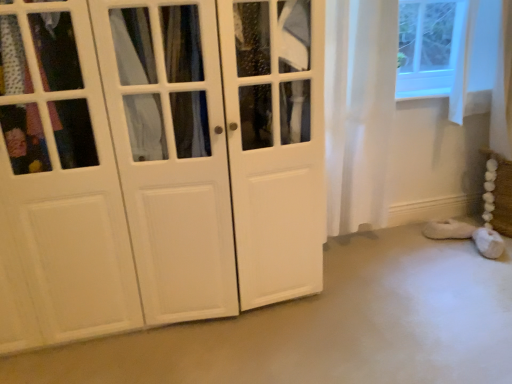
Question: Should I look upward or downward to see white fluffy slipper at lower right?

Choices:
 (A) down
 (B) up

Answer: (A)

Question: Can white sheer curtain at right be found inside white matte cabinet at left?

Choices:
 (A) yes
 (B) no

Answer: (B)

Question: Is white matte cabinet at left closer to the viewer compared to white sheer curtain at right?

Choices:
 (A) yes
 (B) no

Answer: (A)

Question: Considering the relative positions of white matte cabinet at left and white sheer curtain at right in the image provided, is white matte cabinet at left behind white sheer curtain at right?

Choices:
 (A) no
 (B) yes

Answer: (A)

Question: Is white matte cabinet at left positioned with its back to white sheer curtain at right?

Choices:
 (A) no
 (B) yes

Answer: (A)

Question: Considering the relative sizes of white matte cabinet at left and white sheer curtain at right in the image provided, is white matte cabinet at left taller than white sheer curtain at right?

Choices:
 (A) yes
 (B) no

Answer: (A)

Question: Considering the relative sizes of white matte cabinet at left and white sheer curtain at right in the image provided, is white matte cabinet at left shorter than white sheer curtain at right?

Choices:
 (A) yes
 (B) no

Answer: (B)

Question: From a real-world perspective, does white fluffy slipper at lower right stand above white matte cabinet at left?

Choices:
 (A) no
 (B) yes

Answer: (A)

Question: Is white fluffy slipper at lower right further to camera compared to white matte cabinet at left?

Choices:
 (A) yes
 (B) no

Answer: (A)

Question: From the image's perspective, is white fluffy slipper at lower right over white matte cabinet at left?

Choices:
 (A) yes
 (B) no

Answer: (B)

Question: Is white fluffy slipper at lower right shorter than white matte cabinet at left?

Choices:
 (A) yes
 (B) no

Answer: (A)

Question: From a real-world perspective, is white fluffy slipper at lower right below white matte cabinet at left?

Choices:
 (A) no
 (B) yes

Answer: (B)

Question: Does white fluffy slipper at lower right come in front of white matte cabinet at left?

Choices:
 (A) yes
 (B) no

Answer: (B)

Question: Is white fluffy slipper at lower right thinner than white sheer curtain at right?

Choices:
 (A) no
 (B) yes

Answer: (B)